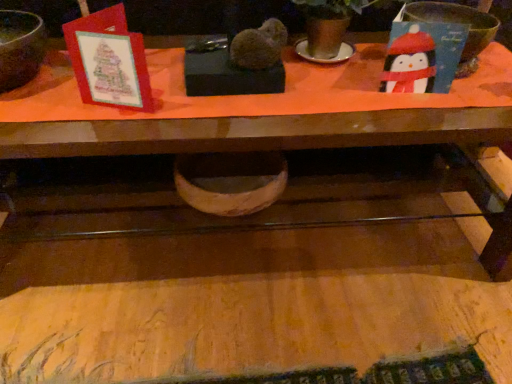
Locate an element on the screen. The image size is (512, 384). vacant area on top of wooden table at lower center (from a real-world perspective) is located at coordinates (244, 359).